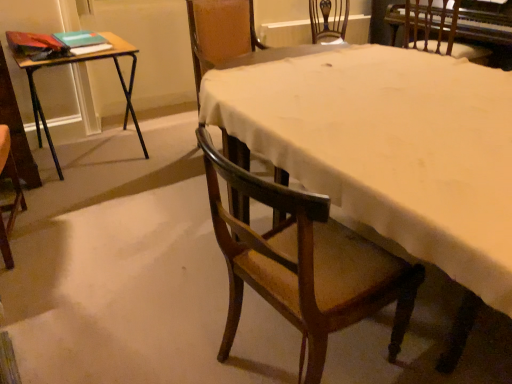
In order to click on green matte book at upper left, arranged as the 1th book when ordered from the bottom in this screenshot , I will do `click(90, 49)`.

The height and width of the screenshot is (384, 512). What do you see at coordinates (304, 265) in the screenshot? I see `wooden chair at lower right, the third chair viewed from the back` at bounding box center [304, 265].

Locate an element on the screen. wooden chair at upper right, which ranks as the third chair in front-to-back order is located at coordinates (438, 31).

The height and width of the screenshot is (384, 512). Describe the element at coordinates (389, 147) in the screenshot. I see `white cloth at center` at that location.

Where is `green matte book at upper left, which ranks as the first book in top-to-bottom order`? The image size is (512, 384). green matte book at upper left, which ranks as the first book in top-to-bottom order is located at coordinates (80, 39).

Are green matte book at upper left, arranged as the 1th book when ordered from the bottom, and green matte book at upper left, which is the second book from bottom to top, making contact?

No.

Does green matte book at upper left, which ranks as the 2th book in top-to-bottom order, come behind green matte book at upper left, which ranks as the first book in top-to-bottom order?

No, green matte book at upper left, which ranks as the 2th book in top-to-bottom order, is closer to the viewer.

Is green matte book at upper left, arranged as the 1th book when ordered from the bottom, spatially inside green matte book at upper left, which is the second book from bottom to top, or outside of it?

green matte book at upper left, arranged as the 1th book when ordered from the bottom, exists outside the volume of green matte book at upper left, which is the second book from bottom to top.

Is green matte book at upper left, which ranks as the 2th book in top-to-bottom order, facing away from green matte book at upper left, which is the second book from bottom to top?

No, green matte book at upper left, which ranks as the 2th book in top-to-bottom order, is not facing the opposite direction of green matte book at upper left, which is the second book from bottom to top.

Is the depth of wooden folding table at left less than that of green matte book at upper left, arranged as the 1th book when ordered from the bottom?

Yes, wooden folding table at left is closer to the viewer.

Looking at their sizes, would you say wooden folding table at left is wider or thinner than green matte book at upper left, which ranks as the 2th book in top-to-bottom order?

wooden folding table at left is wider than green matte book at upper left, which ranks as the 2th book in top-to-bottom order.

Is wooden folding table at left to the right of green matte book at upper left, arranged as the 1th book when ordered from the bottom, from the viewer's perspective?

Incorrect, wooden folding table at left is not on the right side of green matte book at upper left, arranged as the 1th book when ordered from the bottom.

Considering the sizes of objects wooden folding table at left and green matte book at upper left, arranged as the 1th book when ordered from the bottom, in the image provided, who is smaller, wooden folding table at left or green matte book at upper left, arranged as the 1th book when ordered from the bottom,?

green matte book at upper left, arranged as the 1th book when ordered from the bottom.

From the image's perspective, is wooden folding table at left above wooden chair at lower right, which appears as the first chair when viewed from the front?

Yes.

Is wooden folding table at left behind wooden chair at lower right, which appears as the first chair when viewed from the front?

Yes, wooden folding table at left is further from the camera.

Which object is positioned more to the right, wooden folding table at left or wooden chair at lower right, the third chair viewed from the back?

wooden chair at lower right, the third chair viewed from the back.

Considering the relative sizes of wooden folding table at left and wooden chair at upper right, which is the first chair in back-to-front order, in the image provided, is wooden folding table at left thinner than wooden chair at upper right, which is the first chair in back-to-front order,?

In fact, wooden folding table at left might be wider than wooden chair at upper right, which is the first chair in back-to-front order.

Which is correct: wooden folding table at left is inside wooden chair at upper right, the 1th chair when ordered from right to left, or outside of it?

wooden folding table at left is not enclosed by wooden chair at upper right, the 1th chair when ordered from right to left.

Is wooden folding table at left touching wooden chair at upper right, the 1th chair when ordered from right to left?

No, wooden folding table at left is not beside wooden chair at upper right, the 1th chair when ordered from right to left.

From the image's perspective, relative to white cloth at center, is wooden chair at lower right, marked as the 2th chair in a left-to-right arrangement, above or below?

From the image's perspective, wooden chair at lower right, marked as the 2th chair in a left-to-right arrangement, appears below white cloth at center.

You are a GUI agent. You are given a task and a screenshot of the screen. Output one action in this format:
    pyautogui.click(x=<x>, y=<y>)
    Task: Click on the 1st chair behind the white cloth at center, starting your count from the anchor
    
    Given the screenshot: What is the action you would take?
    pyautogui.click(x=304, y=265)

From a real-world perspective, is wooden chair at lower right, the third chair viewed from the back, positioned above or below white cloth at center?

wooden chair at lower right, the third chair viewed from the back, is situated higher than white cloth at center in the real world.

Between wooden chair at lower right, the third chair viewed from the back, and white cloth at center, which one has smaller width?

Thinner between the two is wooden chair at lower right, the third chair viewed from the back.

Which object is wider, green matte book at upper left, which ranks as the 2th book in top-to-bottom order, or white cloth at center?

Wider between the two is white cloth at center.

Is green matte book at upper left, arranged as the 1th book when ordered from the bottom, next to white cloth at center?

green matte book at upper left, arranged as the 1th book when ordered from the bottom, and white cloth at center are clearly separated.

Can you tell me how much green matte book at upper left, arranged as the 1th book when ordered from the bottom, and white cloth at center differ in facing direction?

101 degrees separate the facing orientations of green matte book at upper left, arranged as the 1th book when ordered from the bottom, and white cloth at center.

Is white cloth at center completely or partially inside green matte book at upper left, arranged as the 1th book when ordered from the bottom?

Actually, white cloth at center is outside green matte book at upper left, arranged as the 1th book when ordered from the bottom.

Is wooden folding table at left smaller than white cloth at center?

Correct, wooden folding table at left occupies less space than white cloth at center.

Is white cloth at center at the back of wooden folding table at left?

No, wooden folding table at left's orientation is not away from white cloth at center.

Consider the image. From the image's perspective, which object appears higher, wooden folding table at left or white cloth at center?

wooden folding table at left.

Which point is more forward, (124,53) or (456,200)?

Positioned in front is point (456,200).

I want to click on book above the green matte book at upper left, which ranks as the 2th book in top-to-bottom order (from the image's perspective), so click(x=80, y=39).

In order to click on table below the green matte book at upper left, which ranks as the 2th book in top-to-bottom order (from the image's perspective) in this screenshot , I will do `click(78, 63)`.

Looking at the image, which one is located further to wooden chair at upper right, which appears as the third chair when viewed from the left, wooden chair at lower right, which appears as the first chair when viewed from the front, or wooden chair at center, acting as the 1th chair starting from the left?

wooden chair at lower right, which appears as the first chair when viewed from the front, is positioned further to the anchor wooden chair at upper right, which appears as the third chair when viewed from the left.

Based on the photo, estimate the real-world distances between objects in this image. Which object is closer to green matte book at upper left, which ranks as the first book in top-to-bottom order, wooden chair at lower right, the second chair viewed from the right, or wooden folding table at left?

Based on the image, wooden folding table at left appears to be nearer to green matte book at upper left, which ranks as the first book in top-to-bottom order.

From the image, which object appears to be nearer to green matte book at upper left, which is the second book from bottom to top, wooden chair at center, the 2th chair when ordered from front to back, or green matte book at upper left, which ranks as the 2th book in top-to-bottom order?

green matte book at upper left, which ranks as the 2th book in top-to-bottom order, lies closer to green matte book at upper left, which is the second book from bottom to top, than the other object.

Which object lies nearer to the anchor point wooden chair at upper right, which is the first chair in back-to-front order, green matte book at upper left, which ranks as the 2th book in top-to-bottom order, or wooden chair at center, which is counted as the third chair, starting from the right?

wooden chair at center, which is counted as the third chair, starting from the right, is positioned closer to the anchor wooden chair at upper right, which is the first chair in back-to-front order.

Estimate the real-world distances between objects in this image. Which object is closer to wooden chair at upper right, which appears as the third chair when viewed from the left, wooden chair at lower right, the third chair viewed from the back, or white cloth at center?

white cloth at center.

From the image, which object appears to be nearer to white cloth at center, wooden chair at lower right, the third chair viewed from the back, or wooden chair at upper right, which is the first chair in back-to-front order?

wooden chair at lower right, the third chair viewed from the back.

Looking at the image, which one is located closer to white cloth at center, green matte book at upper left, which ranks as the first book in top-to-bottom order, or green matte book at upper left, which ranks as the 2th book in top-to-bottom order?

green matte book at upper left, which ranks as the 2th book in top-to-bottom order, is closer to white cloth at center.

From the image, which object appears to be farther from green matte book at upper left, which is the second book from bottom to top, wooden chair at upper right, which appears as the third chair when viewed from the left, or wooden chair at lower right, the third chair viewed from the back?

wooden chair at upper right, which appears as the third chair when viewed from the left, is further to green matte book at upper left, which is the second book from bottom to top.

Image resolution: width=512 pixels, height=384 pixels. I want to click on table between wooden chair at lower right, which appears as the first chair when viewed from the front, and green matte book at upper left, which ranks as the first book in top-to-bottom order, in the front-back direction, so click(x=78, y=63).

You are a GUI agent. You are given a task and a screenshot of the screen. Output one action in this format:
    pyautogui.click(x=<x>, y=<y>)
    Task: Click on the book situated between green matte book at upper left, which ranks as the first book in top-to-bottom order, and wooden chair at upper right, the 1th chair when ordered from right to left, from left to right
    Image resolution: width=512 pixels, height=384 pixels.
    Given the screenshot: What is the action you would take?
    pyautogui.click(x=90, y=49)

Where is `table between wooden chair at lower right, marked as the 2th chair in a left-to-right arrangement, and green matte book at upper left, which ranks as the 2th book in top-to-bottom order, in the front-back direction`? Image resolution: width=512 pixels, height=384 pixels. table between wooden chair at lower right, marked as the 2th chair in a left-to-right arrangement, and green matte book at upper left, which ranks as the 2th book in top-to-bottom order, in the front-back direction is located at coordinates (78, 63).

The image size is (512, 384). Identify the location of book situated between green matte book at upper left, which is the second book from bottom to top, and wooden chair at center, the 2th chair when ordered from back to front, from left to right. (90, 49).